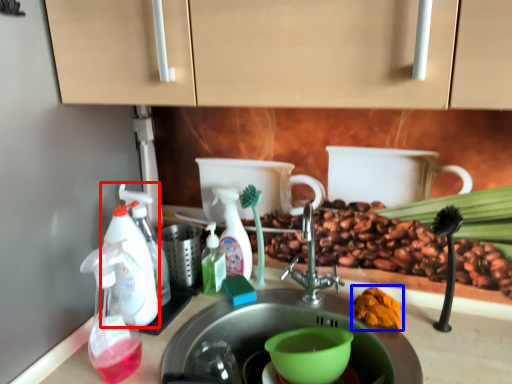
Question: Which point is further to the camera, soap dispenser (highlighted by a red box) or debris (highlighted by a blue box)?

Choices:
 (A) soap dispenser
 (B) debris

Answer: (B)